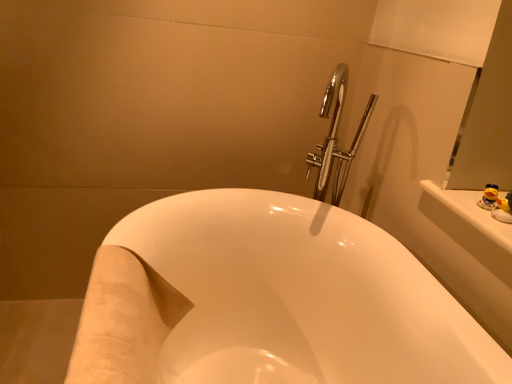
Question: Is yellow rubber duck at upper right, the second toy positioned from the front, bigger than yellow rubber duck at upper right, arranged as the 1th toy when viewed from the front?

Choices:
 (A) no
 (B) yes

Answer: (B)

Question: Does yellow rubber duck at upper right, which is the 1th toy from back to front, appear on the right side of yellow rubber duck at upper right, arranged as the 1th toy when viewed from the front?

Choices:
 (A) yes
 (B) no

Answer: (A)

Question: From a real-world perspective, is yellow rubber duck at upper right, which is the 1th toy from back to front, on yellow rubber duck at upper right, arranged as the 1th toy when viewed from the front?

Choices:
 (A) no
 (B) yes

Answer: (A)

Question: Can you confirm if yellow rubber duck at upper right, the second toy positioned from the front, is thinner than yellow rubber duck at upper right, which appears as the 2th toy when viewed from the back?

Choices:
 (A) no
 (B) yes

Answer: (A)

Question: Is yellow rubber duck at upper right, which is the 1th toy from back to front, to the left of yellow rubber duck at upper right, which appears as the 2th toy when viewed from the back, from the viewer's perspective?

Choices:
 (A) no
 (B) yes

Answer: (A)

Question: From the image's perspective, does yellow rubber duck at upper right, the second toy positioned from the front, appear higher than yellow rubber duck at upper right, arranged as the 1th toy when viewed from the front?

Choices:
 (A) no
 (B) yes

Answer: (B)

Question: Considering the relative sizes of yellow rubber duck at upper right, which appears as the 2th toy when viewed from the back, and white glossy bathtub at center in the image provided, is yellow rubber duck at upper right, which appears as the 2th toy when viewed from the back, thinner than white glossy bathtub at center?

Choices:
 (A) no
 (B) yes

Answer: (B)

Question: Is yellow rubber duck at upper right, which appears as the 2th toy when viewed from the back, far from white glossy bathtub at center?

Choices:
 (A) yes
 (B) no

Answer: (B)

Question: Considering the relative sizes of yellow rubber duck at upper right, arranged as the 1th toy when viewed from the front, and white glossy bathtub at center in the image provided, is yellow rubber duck at upper right, arranged as the 1th toy when viewed from the front, bigger than white glossy bathtub at center?

Choices:
 (A) no
 (B) yes

Answer: (A)

Question: From the image's perspective, is yellow rubber duck at upper right, arranged as the 1th toy when viewed from the front, located beneath white glossy bathtub at center?

Choices:
 (A) no
 (B) yes

Answer: (A)

Question: From a real-world perspective, is yellow rubber duck at upper right, which appears as the 2th toy when viewed from the back, below white glossy bathtub at center?

Choices:
 (A) yes
 (B) no

Answer: (B)

Question: Is the position of yellow rubber duck at upper right, arranged as the 1th toy when viewed from the front, less distant than that of white glossy bathtub at center?

Choices:
 (A) yes
 (B) no

Answer: (B)

Question: Does white glossy bathtub at center appear on the right side of yellow rubber duck at upper right, which appears as the 2th toy when viewed from the back?

Choices:
 (A) no
 (B) yes

Answer: (A)